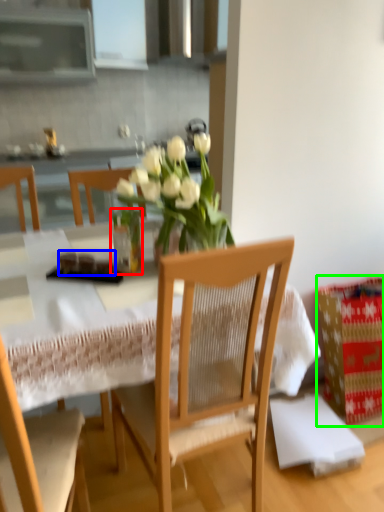
Question: Which is farther away from glass vase (highlighted by a red box)? food (highlighted by a blue box) or cardboard box (highlighted by a green box)?

Choices:
 (A) food
 (B) cardboard box

Answer: (B)